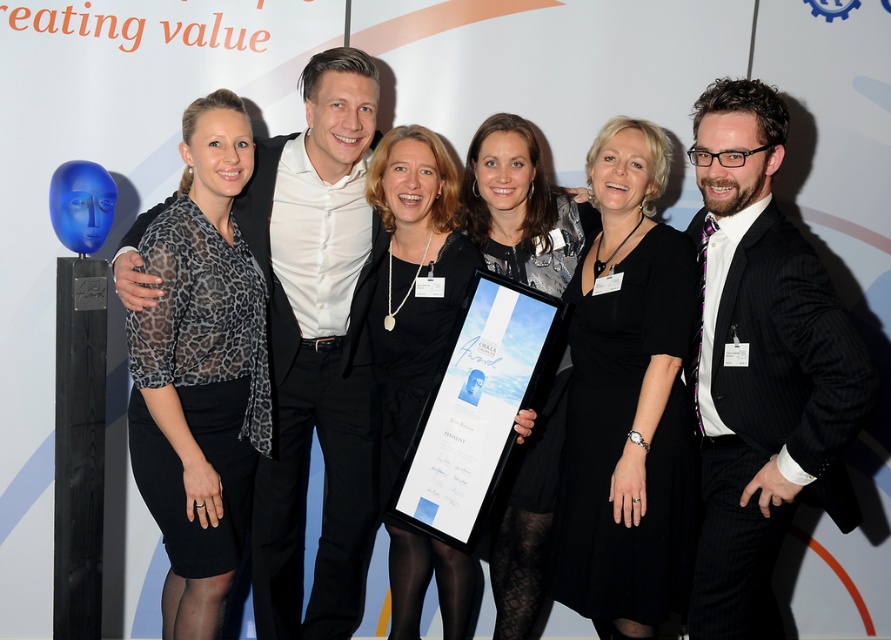
Question: Which point appears closest to the camera in this image?

Choices:
 (A) (509, 180)
 (B) (689, 412)
 (C) (169, 228)
 (D) (800, 241)

Answer: (D)

Question: Is black pinstripe suit at center smaller than black dress at center?

Choices:
 (A) no
 (B) yes

Answer: (A)

Question: Which point is farther from the camera taking this photo?

Choices:
 (A) (582, 205)
 (B) (198, 420)
 (C) (634, 444)

Answer: (A)

Question: Based on their relative distances, which object is farther from the black sheer blouse at left?

Choices:
 (A) matte black dress at center
 (B) black satin dress at center
 (C) black dress at center

Answer: (C)

Question: Observing the image, what is the correct spatial positioning of black dress at center in reference to black satin dress at center?

Choices:
 (A) right
 (B) left

Answer: (A)

Question: Can you confirm if black satin dress at center is thinner than matte black dress at center?

Choices:
 (A) yes
 (B) no

Answer: (A)